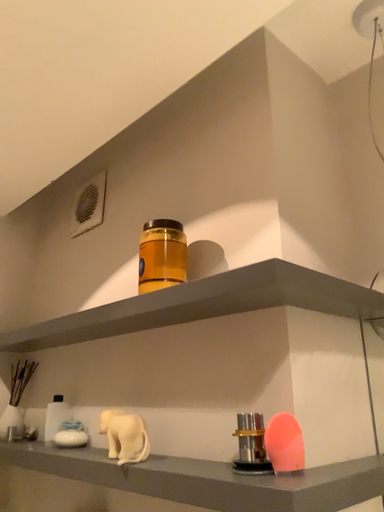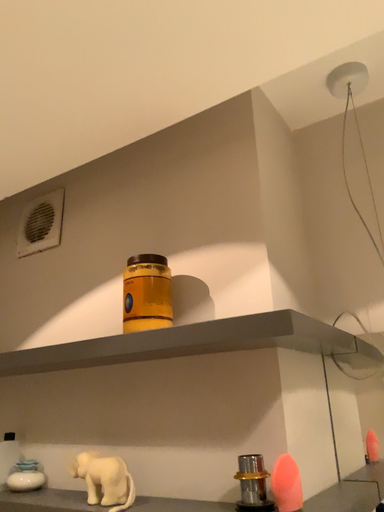
Question: How did the camera likely rotate when shooting the video?

Choices:
 (A) rotated right
 (B) rotated left

Answer: (A)